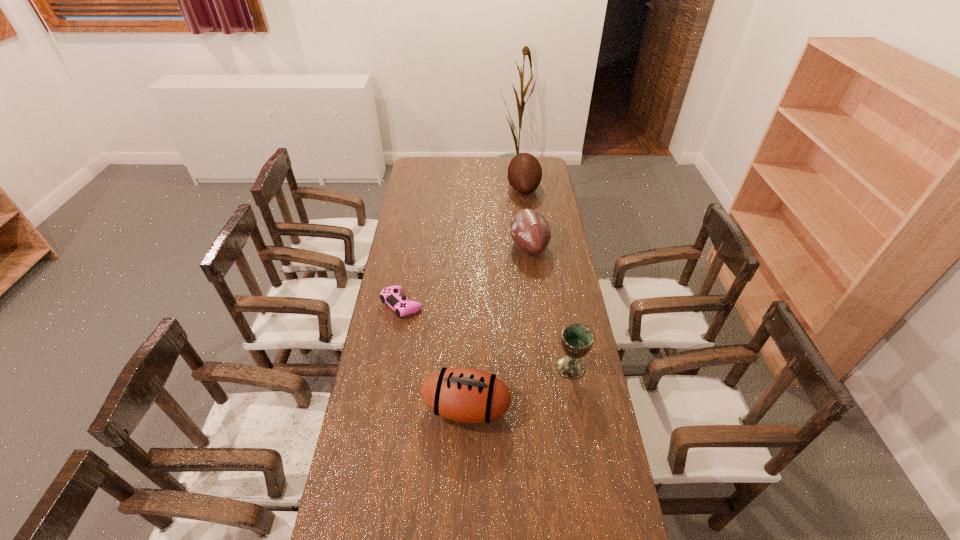
This screenshot has height=540, width=960. What are the coordinates of `free space located on the back of the second nearest football (American)` in the screenshot? It's located at (522, 194).

At what (x,y) coordinates should I click in order to perform the action: click on free space located 0.160m on the front of the chalice. Please return your answer as a coordinate pair (x, y). Looking at the image, I should click on (581, 425).

You are a GUI agent. You are given a task and a screenshot of the screen. Output one action in this format:
    pyautogui.click(x=<x>, y=<y>)
    Task: Click on the vacant space situated on the front of the second object from left to right
    The width and height of the screenshot is (960, 540).
    Given the screenshot: What is the action you would take?
    pyautogui.click(x=466, y=452)

You are a GUI agent. You are given a task and a screenshot of the screen. Output one action in this format:
    pyautogui.click(x=<x>, y=<y>)
    Task: Click on the vacant space situated 0.080m on the back of the control
    The height and width of the screenshot is (540, 960).
    Given the screenshot: What is the action you would take?
    pyautogui.click(x=407, y=276)

Locate an element on the screen. object at the far edge is located at coordinates (524, 174).

Identify the location of object present at the left edge. The width and height of the screenshot is (960, 540). (391, 295).

Image resolution: width=960 pixels, height=540 pixels. I want to click on chalice present at the right edge, so click(577, 340).

Locate an element on the screen. This screenshot has height=540, width=960. object at the far right corner is located at coordinates (524, 174).

Locate an element on the screen. vacant space at the far edge is located at coordinates (455, 176).

I want to click on free spot at the left edge of the desktop, so click(403, 221).